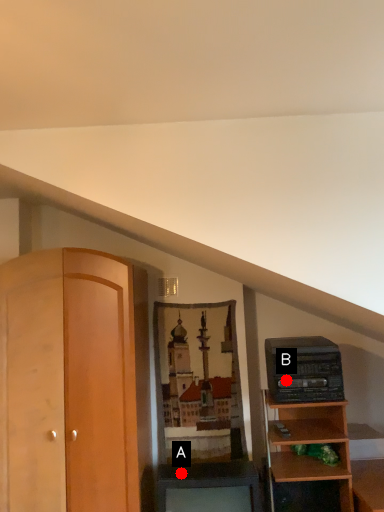
Question: Two points are circled on the image, labeled by A and B beside each circle. Which point is farther from the camera taking this photo?

Choices:
 (A) A is further
 (B) B is further

Answer: (B)